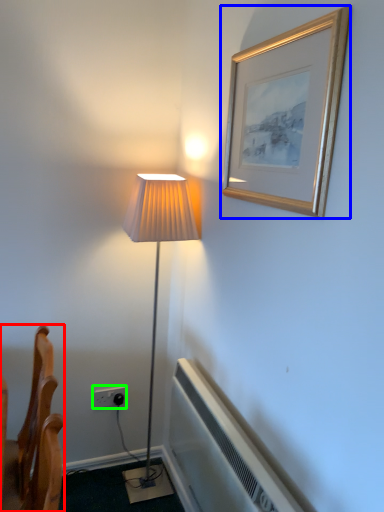
Question: Based on their relative distances, which object is nearer to furniture (highlighted by a red box)? Choose from picture frame (highlighted by a blue box) and electric outlet (highlighted by a green box).

Choices:
 (A) picture frame
 (B) electric outlet

Answer: (B)